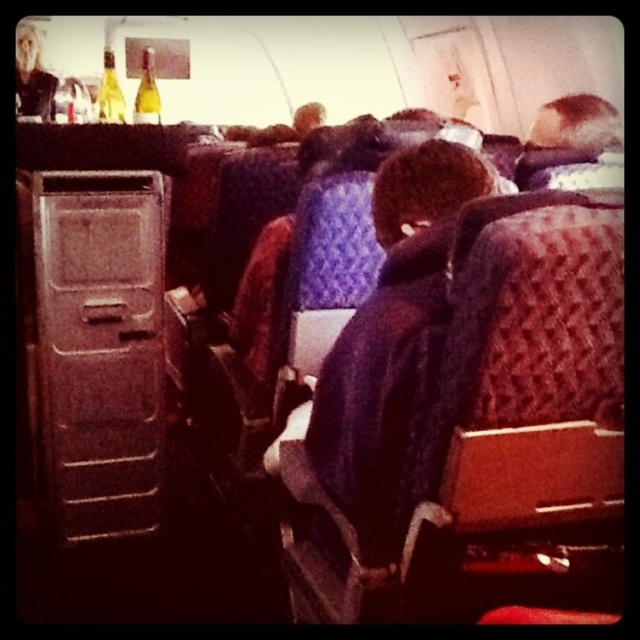
The height and width of the screenshot is (640, 640). Describe the element at coordinates (570, 132) in the screenshot. I see `smooth brown hair at upper right` at that location.

Can you confirm if smooth brown hair at upper right is positioned above green glass bottle at upper left?

Actually, smooth brown hair at upper right is below green glass bottle at upper left.

The image size is (640, 640). I want to click on smooth brown hair at upper right, so click(x=570, y=132).

Is green glass bottle at upper left in front of matte yellow glass bottle at upper left?

No, it is behind matte yellow glass bottle at upper left.

Which is behind, point (99, 115) or point (138, 92)?

The point (138, 92) is more distant.

Consider the image. Who is more distant from viewer, (x=100, y=104) or (x=138, y=86)?

Positioned behind is point (x=138, y=86).

Where is `green glass bottle at upper left`? The width and height of the screenshot is (640, 640). green glass bottle at upper left is located at coordinates (109, 92).

What do you see at coordinates (570, 132) in the screenshot? This screenshot has width=640, height=640. I see `smooth brown hair at upper right` at bounding box center [570, 132].

In the scene shown: Does smooth brown hair at upper right have a greater width compared to matte yellow glass bottle at upper left?

Yes, smooth brown hair at upper right is wider than matte yellow glass bottle at upper left.

Which is in front, point (573, 161) or point (150, 54)?

Point (573, 161)

Find the location of `smooth brown hair at upper right`. smooth brown hair at upper right is located at coordinates (570, 132).